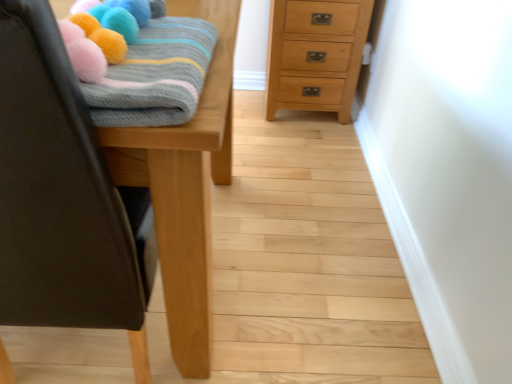
Question: Does point (167, 187) appear closer or farther from the camera than point (302, 36)?

Choices:
 (A) farther
 (B) closer

Answer: (B)

Question: Looking at their shapes, would you say wooden table at left is wider or thinner than natural wood chest of drawers at upper right?

Choices:
 (A) thin
 (B) wide

Answer: (B)

Question: Estimate the real-world distances between objects in this image. Which object is farther from the knitted woolen blanket at upper left?

Choices:
 (A) natural wood chest of drawers at upper right
 (B) wooden table at left

Answer: (A)

Question: Which object is the closest to the knitted woolen blanket at upper left?

Choices:
 (A) natural wood chest of drawers at upper right
 (B) wooden table at left

Answer: (B)